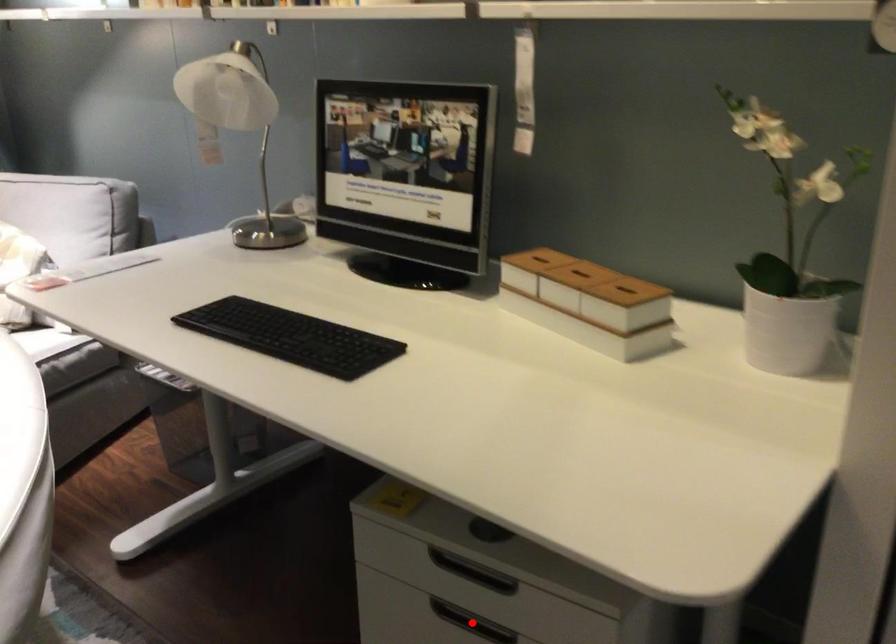
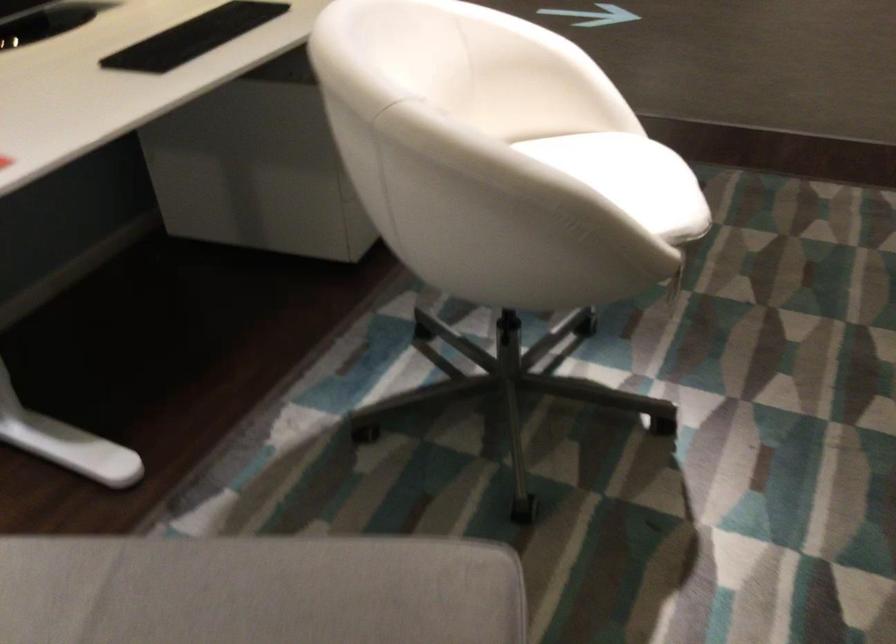
Question: I am providing you with two images of the same scene from different viewpoints. A red point is marked on the first image. Is the red point's position out of view in image 2?

Choices:
 (A) Yes
 (B) No

Answer: (A)